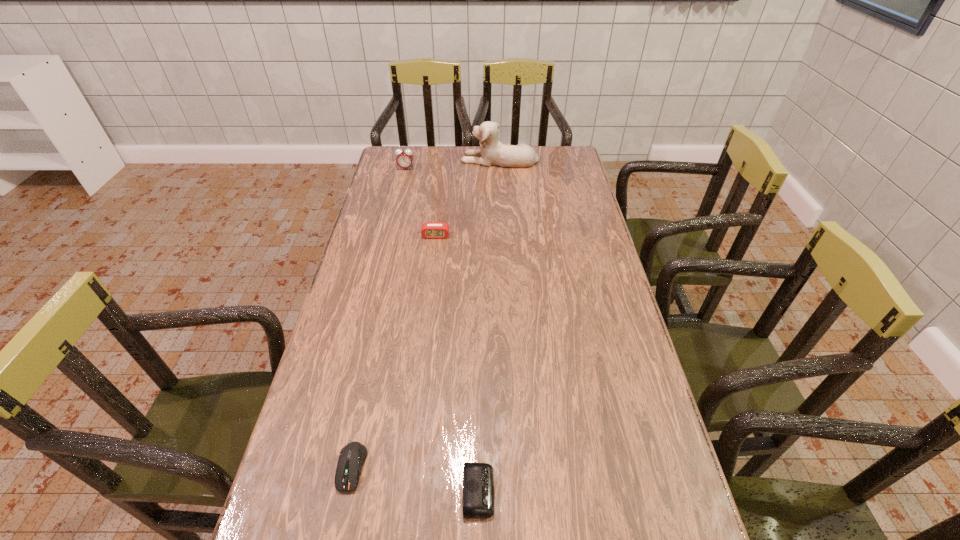
The width and height of the screenshot is (960, 540). In order to click on free space that satisfies the following two spatial constraints: 1. on the front-facing side of the puppy; 2. on the button of the computer equipment in this screenshot , I will do `click(518, 467)`.